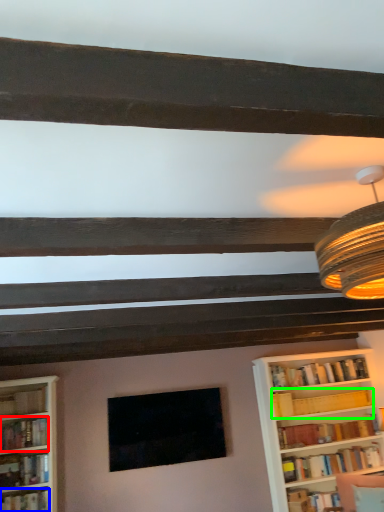
Question: Which object is the farthest from book (highlighted by a red box)? Choose among these: book (highlighted by a blue box) or book (highlighted by a green box).

Choices:
 (A) book
 (B) book

Answer: (B)